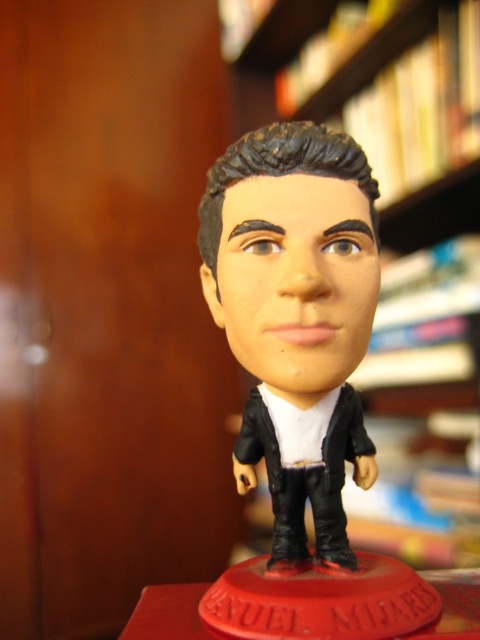
You are organizing a display in a museum and need to place the black matte business suit at center and the wooden bookshelf at upper center. According to the image, which object is located to the left of the other?

The black matte business suit at center is positioned on the left side of wooden bookshelf at upper center.

Where is the black matte business suit at center located in the image?

The black matte business suit at center is located at point [307,477].